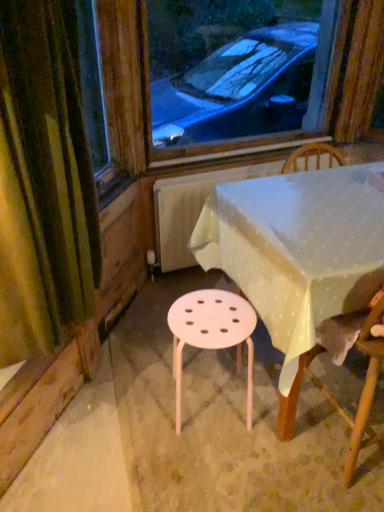
Find the location of `unoccupied space behind pink plastic stool at center`. unoccupied space behind pink plastic stool at center is located at coordinates (196, 355).